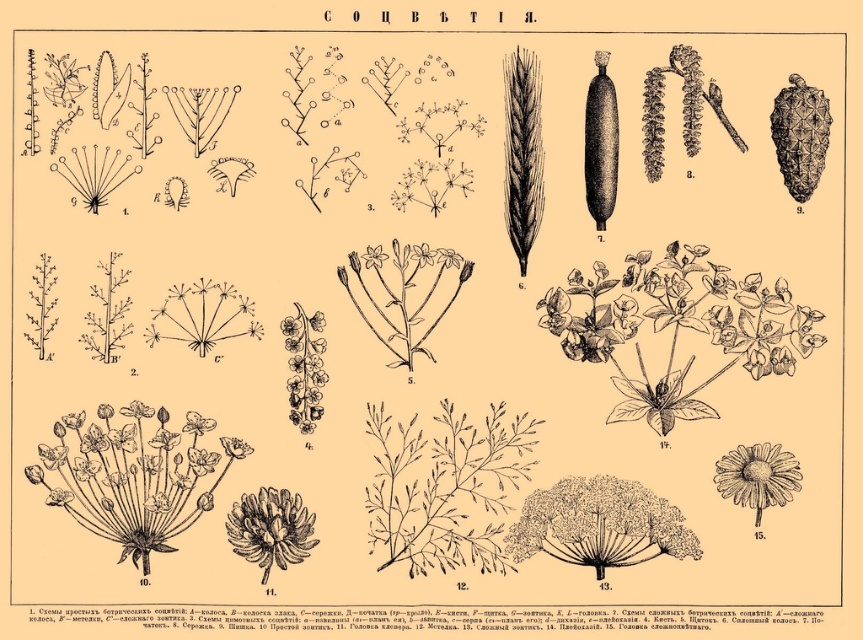
You are a botanist examining this botanical illustration. You need to locate the smooth green leaves at center and the white textured flower at lower right. Based on their positions, which object is situated higher in the illustration?

The smooth green leaves at center is located above the white textured flower at lower right, so it is situated higher in the illustration.

You are a botanist examining the botanical illustration. You need to locate the brown textured flower at center and the white textured flower at lower right. Based on their positions, which flower is positioned to the right side of the illustration?

The white textured flower at lower right is positioned to the right side of the illustration because the brown textured flower at center is to the left of it.